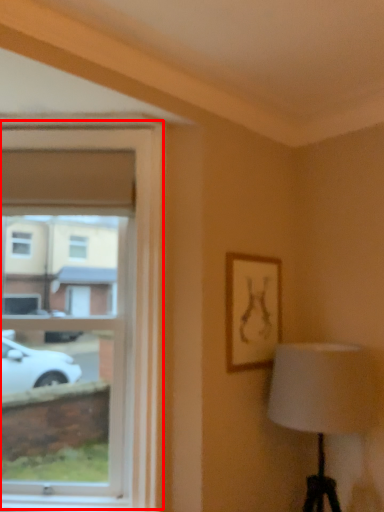
Question: Considering the relative positions of window (annotated by the red box) and picture frame in the image provided, where is window (annotated by the red box) located with respect to the staircase?

Choices:
 (A) right
 (B) left

Answer: (B)